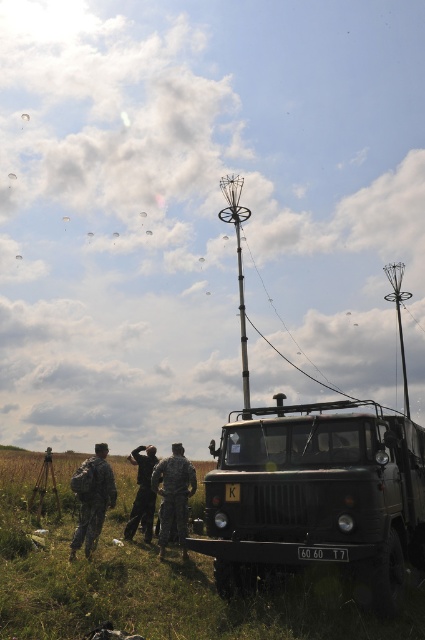
Question: Which is farther from the camouflage fabric uniform at lower left?

Choices:
 (A) camouflage painted truck at center
 (B) camouflage fabric uniform at center
 (C) camouflage uniform at center
 (D) green grassy field at lower center

Answer: (A)

Question: Is the position of green grassy field at lower center more distant than that of camouflage fabric uniform at center?

Choices:
 (A) yes
 (B) no

Answer: (B)

Question: Considering the real-world distances, which object is farthest from the green grassy field at lower center?

Choices:
 (A) camouflage fabric uniform at lower left
 (B) camouflage painted truck at center
 (C) camouflage uniform at center
 (D) camouflage fabric uniform at center

Answer: (C)

Question: Is green grassy field at lower center above camouflage fabric uniform at lower left?

Choices:
 (A) yes
 (B) no

Answer: (B)

Question: Which object is positioned closest to the camouflage uniform at center?

Choices:
 (A) camouflage fabric uniform at center
 (B) camouflage painted truck at center
 (C) camouflage fabric uniform at lower left

Answer: (A)

Question: Can you confirm if camouflage fabric uniform at center is positioned to the right of camouflage uniform at center?

Choices:
 (A) yes
 (B) no

Answer: (A)